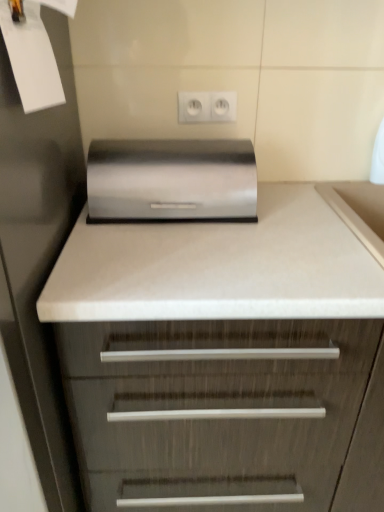
Locate an element on the screen. blank space above satin metallic breadbox at center (from a real-world perspective) is located at coordinates pos(173,143).